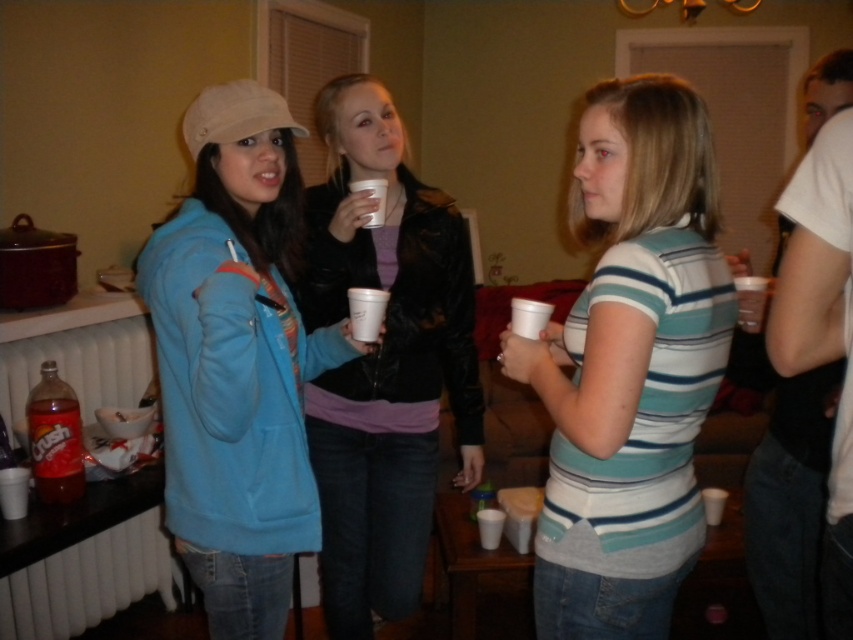
Is matte blue hoodie at left thinner than translucent plastic bottle of crush soda at lower left?

In fact, matte blue hoodie at left might be wider than translucent plastic bottle of crush soda at lower left.

The image size is (853, 640). What do you see at coordinates (236, 360) in the screenshot?
I see `matte blue hoodie at left` at bounding box center [236, 360].

Where is `matte blue hoodie at left`? matte blue hoodie at left is located at coordinates (236, 360).

Is matte blue hoodie at left bigger than velvet-like black jacket at center?

No.

Does matte blue hoodie at left have a lesser height compared to velvet-like black jacket at center?

Yes, matte blue hoodie at left is shorter than velvet-like black jacket at center.

Between point (221, 484) and point (318, 100), which one is positioned in front?

Positioned in front is point (221, 484).

You are a GUI agent. You are given a task and a screenshot of the screen. Output one action in this format:
    pyautogui.click(x=<x>, y=<y>)
    Task: Click on the matte blue hoodie at left
    
    Given the screenshot: What is the action you would take?
    pyautogui.click(x=236, y=360)

Does point (640, 80) lie behind point (73, 474)?

That is False.

Describe the element at coordinates (630, 365) in the screenshot. I see `striped cotton shirt at center` at that location.

Does point (724, 316) come behind point (77, 465)?

No, it is not.

Locate an element on the screen. striped cotton shirt at center is located at coordinates (630, 365).